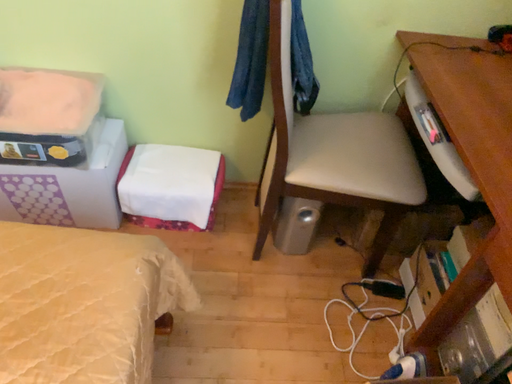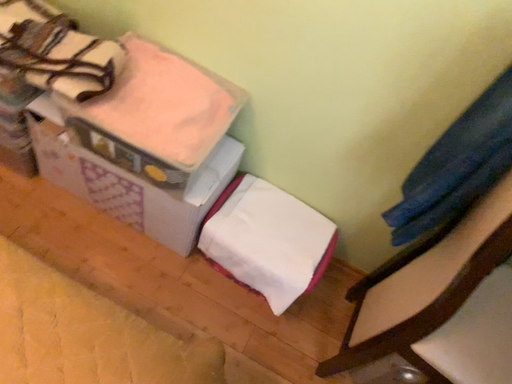
Question: How did the camera likely rotate when shooting the video?

Choices:
 (A) rotated left
 (B) rotated right

Answer: (A)